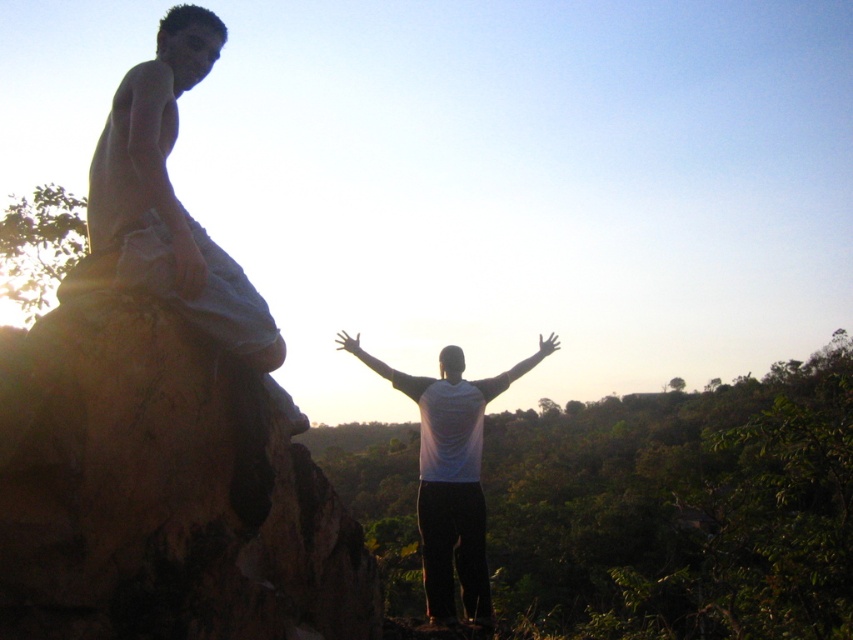
Does white matte shirt at center have a lesser width compared to transparent plastic hand at center?

No, white matte shirt at center is not thinner than transparent plastic hand at center.

Can you confirm if white matte shirt at center is bigger than transparent plastic hand at center?

Correct, white matte shirt at center is larger in size than transparent plastic hand at center.

Between point (454, 488) and point (540, 348), which one is positioned in front?

Point (454, 488) is more forward.

In order to click on white matte shirt at center in this screenshot , I will do `click(451, 480)`.

How much distance is there between matte white hand at upper left and transparent plastic hand at center?

A distance of 4.18 meters exists between matte white hand at upper left and transparent plastic hand at center.

Does matte white hand at upper left appear under transparent plastic hand at center?

Incorrect, matte white hand at upper left is not positioned below transparent plastic hand at center.

The image size is (853, 640). Identify the location of matte white hand at upper left. [x=187, y=264].

Looking at this image, who is positioned more to the left, matte white hand at upper left or white matte hand at center?

Positioned to the left is matte white hand at upper left.

Can you confirm if matte white hand at upper left is positioned to the left of white matte hand at center?

Correct, you'll find matte white hand at upper left to the left of white matte hand at center.

Which is behind, point (177, 248) or point (349, 342)?

Positioned behind is point (349, 342).

Locate an element on the screen. The width and height of the screenshot is (853, 640). matte white hand at upper left is located at coordinates (187, 264).